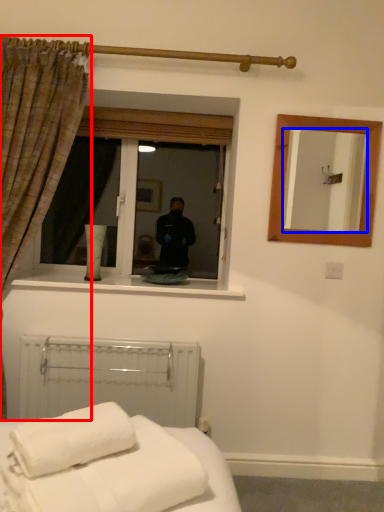
Question: Which of the following is the farthest to the observer, curtain (highlighted by a red box) or mirror (highlighted by a blue box)?

Choices:
 (A) curtain
 (B) mirror

Answer: (B)